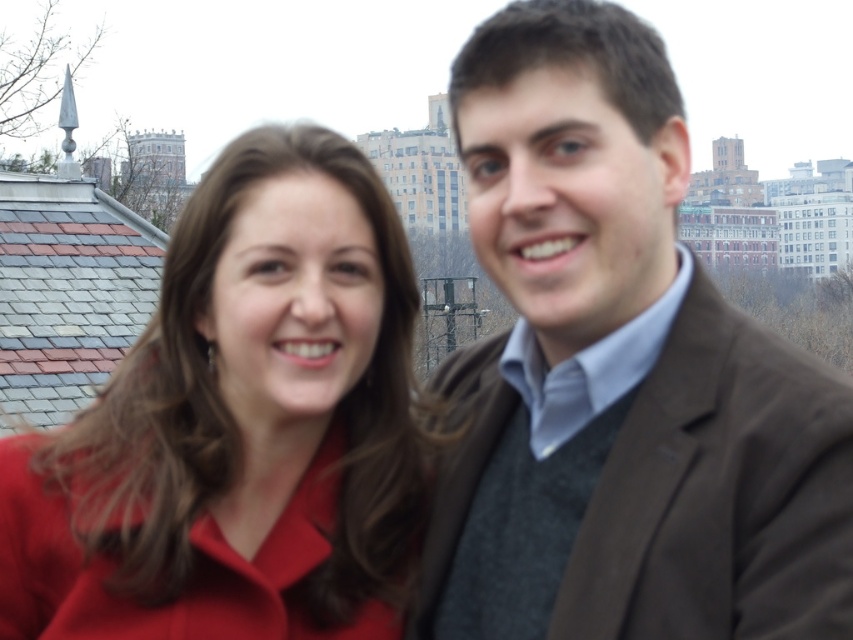
You are a photographer trying to capture a closeup shot of the matte brown jacket at center. Given that your camera has a focal length of 50mm and you are currently 3 meters away from the jacket, will you be able to fill the frame with the jacket without moving closer?

The matte brown jacket at center is located at point [625,381], but without knowing the dimensions of the jacket or the camera sensor size, it is impossible to determine if the jacket will fill the frame at 50mm and 3 meters distance. Additional information is needed.